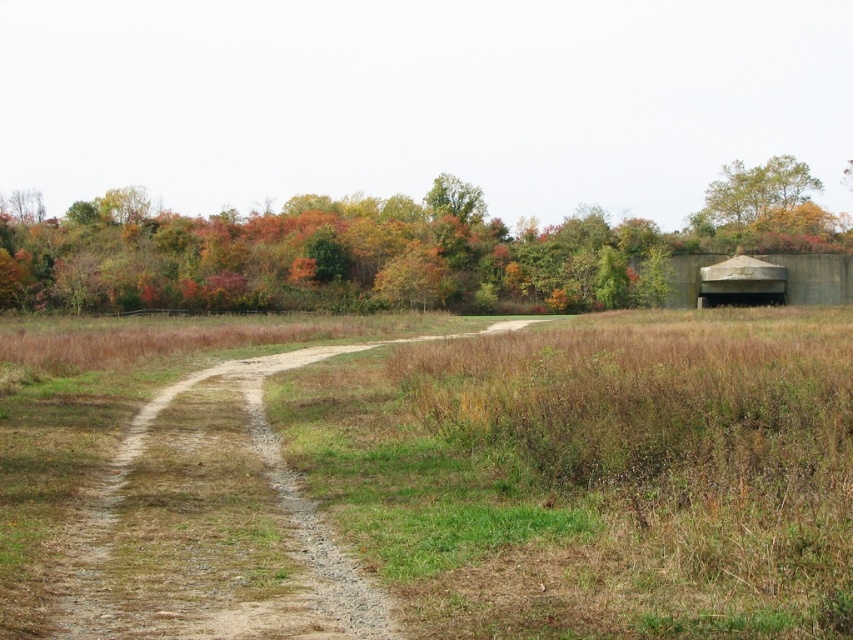
You are a hiker trying to navigate through the rural landscape. You see the green matte tree at upper right and the concrete bunker at right. Which object would block your view more if you were standing between them?

The green matte tree at upper right is much taller as concrete bunker at right, so it would block your view more than the concrete bunker at right.